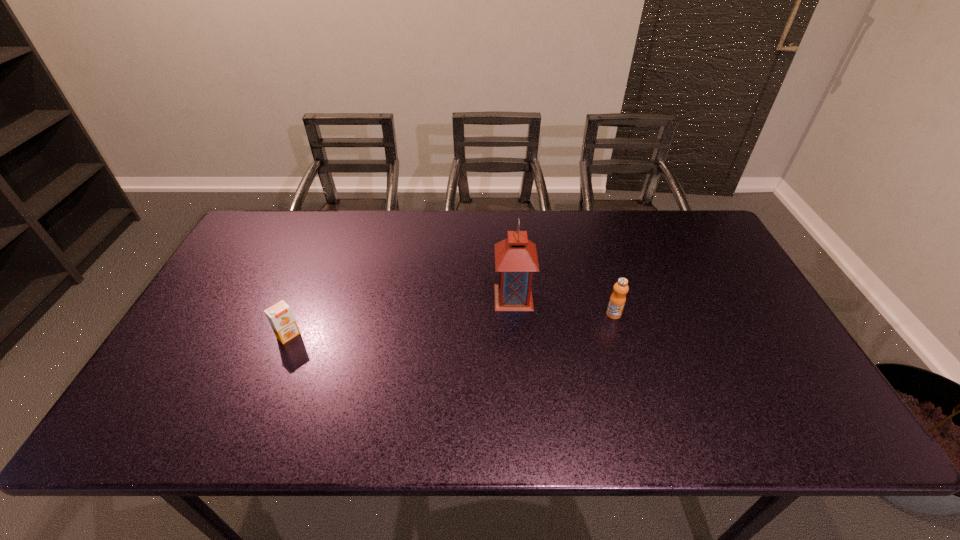
You are a GUI agent. You are given a task and a screenshot of the screen. Output one action in this format:
    pyautogui.click(x=<x>, y=<y>)
    Task: Click on the free space that is in between the nearest object and the taller orange juice
    Image resolution: width=960 pixels, height=540 pixels.
    Given the screenshot: What is the action you would take?
    pyautogui.click(x=451, y=325)

Locate an element on the screen. unoccupied area between the nearer orange juice and the taller orange juice is located at coordinates (451, 325).

Find the location of a particular element. Image resolution: width=960 pixels, height=540 pixels. empty space between the nearest object and the right orange juice is located at coordinates (451, 325).

Locate an element on the screen. The image size is (960, 540). free space between the nearest object and the taller orange juice is located at coordinates (451, 325).

Locate an element on the screen. This screenshot has width=960, height=540. the second closest object to the second object from left to right is located at coordinates (280, 316).

The image size is (960, 540). I want to click on the second closest object to the second object from left to right, so click(280, 316).

Find the location of `free space that satisfies the following two spatial constraints: 1. on the back side of the nearer orange juice; 2. on the left side of the lantern`. free space that satisfies the following two spatial constraints: 1. on the back side of the nearer orange juice; 2. on the left side of the lantern is located at coordinates click(x=304, y=297).

Where is `free space that satisfies the following two spatial constraints: 1. on the back side of the nearer orange juice; 2. on the left side of the second object from right to left`? free space that satisfies the following two spatial constraints: 1. on the back side of the nearer orange juice; 2. on the left side of the second object from right to left is located at coordinates (304, 297).